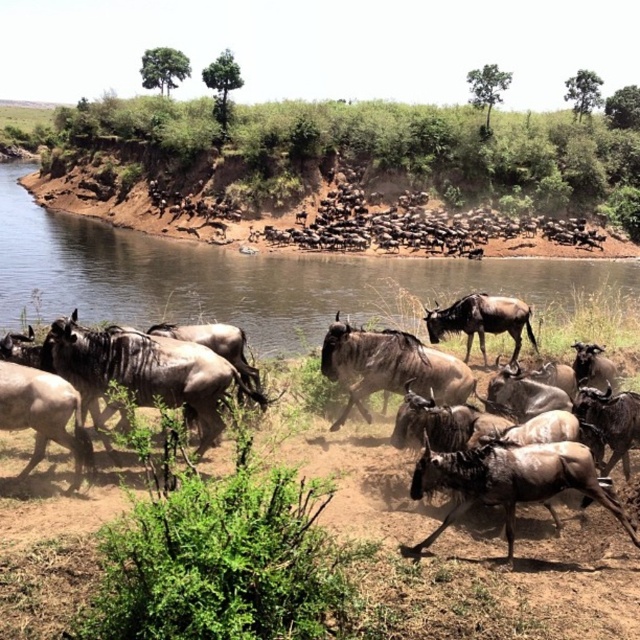
Who is more forward, (552, 576) or (220, 288)?

Positioned in front is point (552, 576).

The width and height of the screenshot is (640, 640). What are the coordinates of `brown sandy dirt field at center` in the screenshot? It's located at (288, 557).

Does point (3, 458) come behind point (314, 205)?

No, (3, 458) is in front of (314, 205).

Does point (243, 563) come behind point (195, 232)?

No, (243, 563) is closer to viewer.

Where is `brown sandy dirt field at center`? The image size is (640, 640). brown sandy dirt field at center is located at coordinates [288, 557].

How distant is brown dirt river at upper center from brown dirt at upper center?

A distance of 8.78 meters exists between brown dirt river at upper center and brown dirt at upper center.

The width and height of the screenshot is (640, 640). Identify the location of brown dirt river at upper center. (273, 282).

The image size is (640, 640). I want to click on brown dirt river at upper center, so pyautogui.click(x=273, y=282).